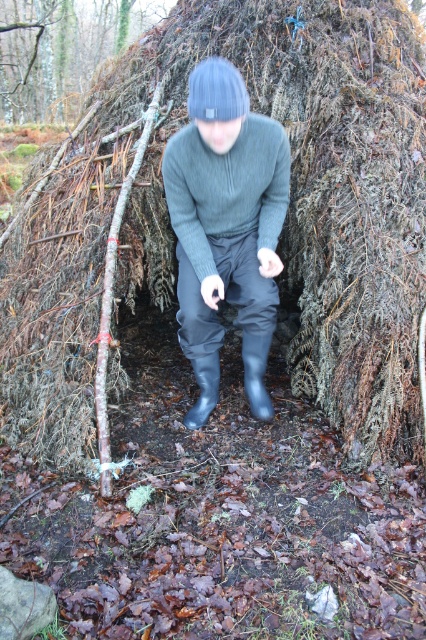
You are an outdoor enthusiast planning to take a photo of the matte gray sweater at center and the brown rough bark at upper left. Which object should you focus on first if you want to capture both in a single frame without moving the camera?

The matte gray sweater at center is positioned on the right side of brown rough bark at upper left, so you should focus on the brown rough bark at upper left first to ensure both are in frame.

You are standing at the entrance of the shelter and want to locate the point marked at coordinates (62, 51). Based on the scene description, where would this point be located?

The point marked at coordinates (62, 51) is on the brown rough bark at upper left.

You are a hiker trying to navigate through the forest and spot the brown rough bark at upper left and the rubber boot at lower center. Which object is located more to the left in the image?

The brown rough bark at upper left is more to the left than the rubber boot at lower center.